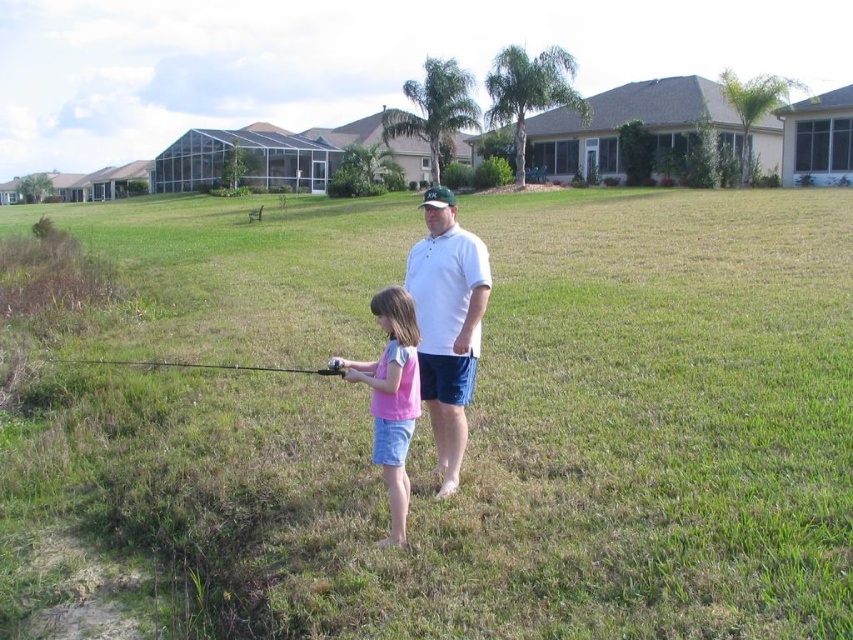
Question: Is pink cotton shirt at center thinner than black matte fishing pole at lower center?

Choices:
 (A) yes
 (B) no

Answer: (A)

Question: Which object appears farthest from the camera in this image?

Choices:
 (A) white cotton shirt at center
 (B) pink cotton shirt at center

Answer: (A)

Question: Can you confirm if green grassy field at center is thinner than black matte fishing pole at lower center?

Choices:
 (A) yes
 (B) no

Answer: (B)

Question: Can you confirm if green grassy field at center is thinner than white cotton shirt at center?

Choices:
 (A) no
 (B) yes

Answer: (A)

Question: Which of these objects is positioned closest to the white cotton shirt at center?

Choices:
 (A) pink cotton shirt at center
 (B) green grassy field at center

Answer: (A)

Question: Which point appears closest to the camera in this image?

Choices:
 (A) (405, 396)
 (B) (293, 371)

Answer: (A)